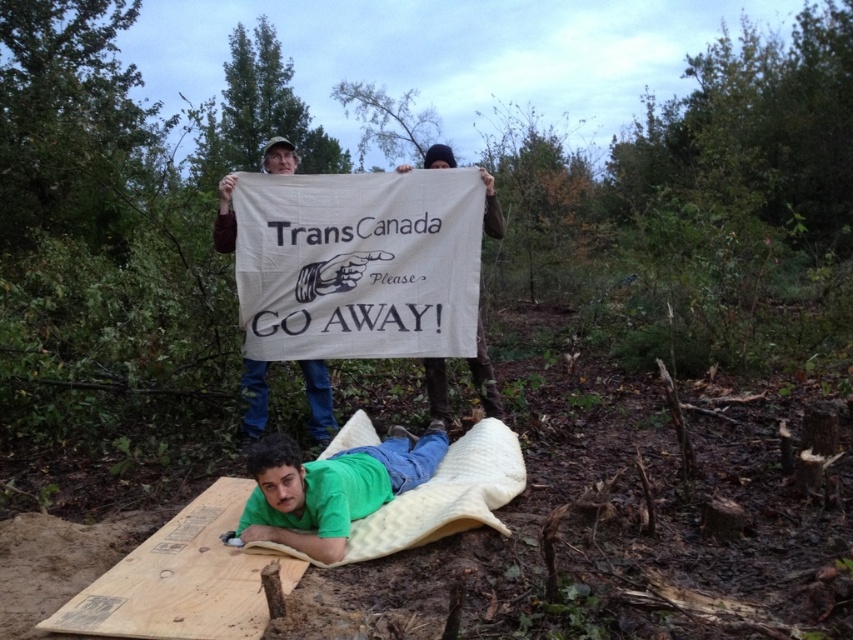
Identify the location of green fabric at lower center. (331, 488).

Which is below, green fabric at lower center or brown cotton shirt at upper center?

green fabric at lower center

Is point (347, 493) positioned before point (229, 237)?

Yes, point (347, 493) is in front of point (229, 237).

You are a GUI agent. You are given a task and a screenshot of the screen. Output one action in this format:
    pyautogui.click(x=<x>, y=<y>)
    Task: Click on the green fabric at lower center
    
    Given the screenshot: What is the action you would take?
    pyautogui.click(x=331, y=488)

Who is more forward, (181, 630) or (434, 400)?

Positioned in front is point (181, 630).

Is wooden plank at lower left taller than white fabric banner at center?

Incorrect, wooden plank at lower left's height is not larger of white fabric banner at center's.

Is point (241, 561) in front of point (489, 218)?

That is True.

The width and height of the screenshot is (853, 640). I want to click on wooden plank at lower left, so click(x=181, y=579).

Does green fabric at lower center have a greater width compared to white fabric banner at center?

Yes.

Is the position of green fabric at lower center less distant than that of white fabric banner at center?

Yes, it is.

Between point (271, 490) and point (440, 144), which one is positioned behind?

The point (440, 144) is behind.

This screenshot has height=640, width=853. Find the location of `green fabric at lower center`. green fabric at lower center is located at coordinates (331, 488).